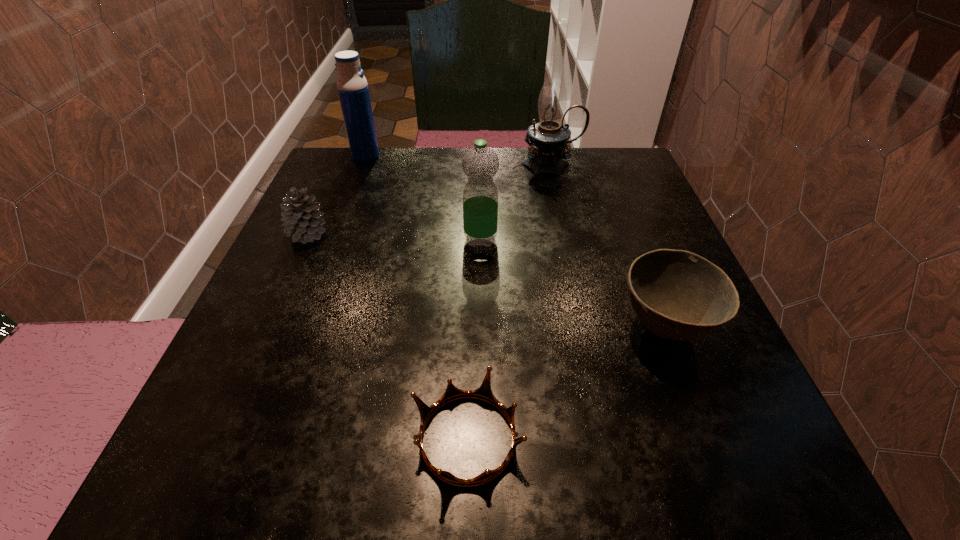
Identify the location of free area in between the shorter water bottle and the shortest object. (474, 339).

This screenshot has width=960, height=540. I want to click on vacant space in between the shortest object and the second nearest object, so click(x=565, y=383).

Locate an element on the screen. vacant space that's between the shortest object and the bowl is located at coordinates (565, 383).

At what (x,y) coordinates should I click in order to perform the action: click on free space between the pinecone and the third tallest object. Please return your answer as a coordinate pair (x, y). This screenshot has height=540, width=960. Looking at the image, I should click on (395, 237).

Find the location of `free point between the tallest object and the crown`. free point between the tallest object and the crown is located at coordinates (510, 301).

You are a GUI agent. You are given a task and a screenshot of the screen. Output one action in this format:
    pyautogui.click(x=<x>, y=<y>)
    Task: Click on the free space between the shortest object and the tallest object
    
    Given the screenshot: What is the action you would take?
    pyautogui.click(x=510, y=301)

I want to click on empty location between the tallest object and the crown, so click(x=510, y=301).

Locate an element on the screen. This screenshot has height=540, width=960. vacant point located between the shorter water bottle and the fifth farthest object is located at coordinates (572, 284).

At what (x,y) coordinates should I click in order to perform the action: click on free point between the fifth farthest object and the tallest object. Please return your answer as a coordinate pair (x, y). This screenshot has width=960, height=540. Looking at the image, I should click on (608, 246).

Find the location of a particular element. The image size is (960, 540). free space between the oil lamp and the fifth farthest object is located at coordinates (608, 246).